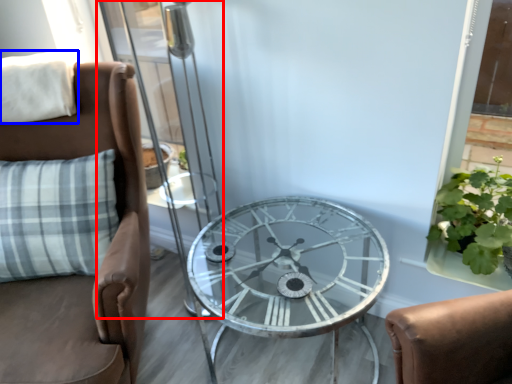
Question: Which point is closer to the camera, screen door (highlighted by a red box) or pillow (highlighted by a blue box)?

Choices:
 (A) screen door
 (B) pillow

Answer: (A)